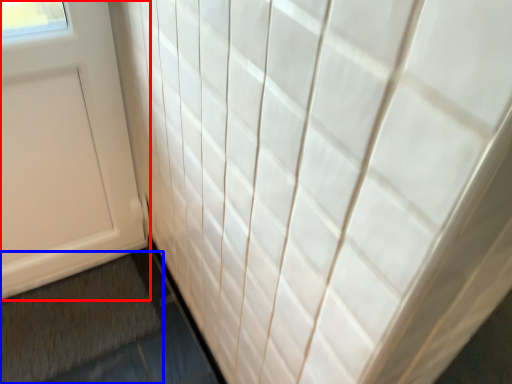
Question: Among these objects, which one is nearest to the camera, door (highlighted by a red box) or bath mat (highlighted by a blue box)?

Choices:
 (A) door
 (B) bath mat

Answer: (A)